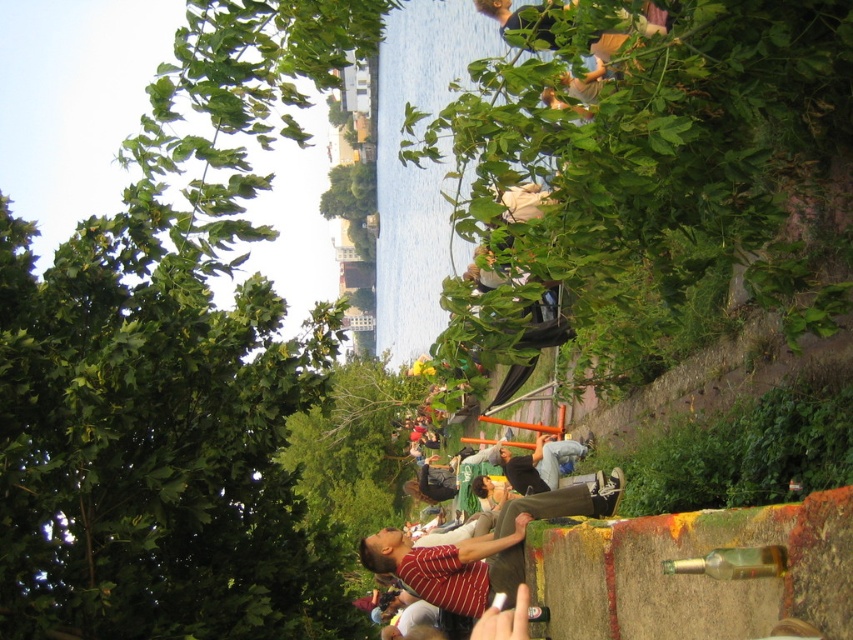
Between green leafy tree at upper left and striped cotton shirt at center, which one is positioned higher?

green leafy tree at upper left is above.

Which of these two, green leafy tree at upper left or striped cotton shirt at center, stands shorter?

striped cotton shirt at center

Is point (160, 218) farther from viewer compared to point (471, 563)?

No, it is in front of (471, 563).

This screenshot has height=640, width=853. What are the coordinates of `green leafy tree at upper left` in the screenshot? It's located at (170, 368).

Who is higher up, striped cotton shirt at center or dark gray fabric pants at center?

dark gray fabric pants at center is above.

Is striped cotton shirt at center positioned in front of dark gray fabric pants at center?

Yes.

You are a GUI agent. You are given a task and a screenshot of the screen. Output one action in this format:
    pyautogui.click(x=<x>, y=<y>)
    Task: Click on the striped cotton shirt at center
    The image size is (853, 640).
    Given the screenshot: What is the action you would take?
    pyautogui.click(x=483, y=548)

Locate an element on the screen. The width and height of the screenshot is (853, 640). striped cotton shirt at center is located at coordinates (483, 548).

Who is more forward, (228, 428) or (524, 458)?

Point (228, 428) is in front.

Between green leafy tree at upper left and dark gray fabric pants at center, which one appears on the left side from the viewer's perspective?

green leafy tree at upper left is more to the left.

The height and width of the screenshot is (640, 853). I want to click on green leafy tree at upper left, so click(170, 368).